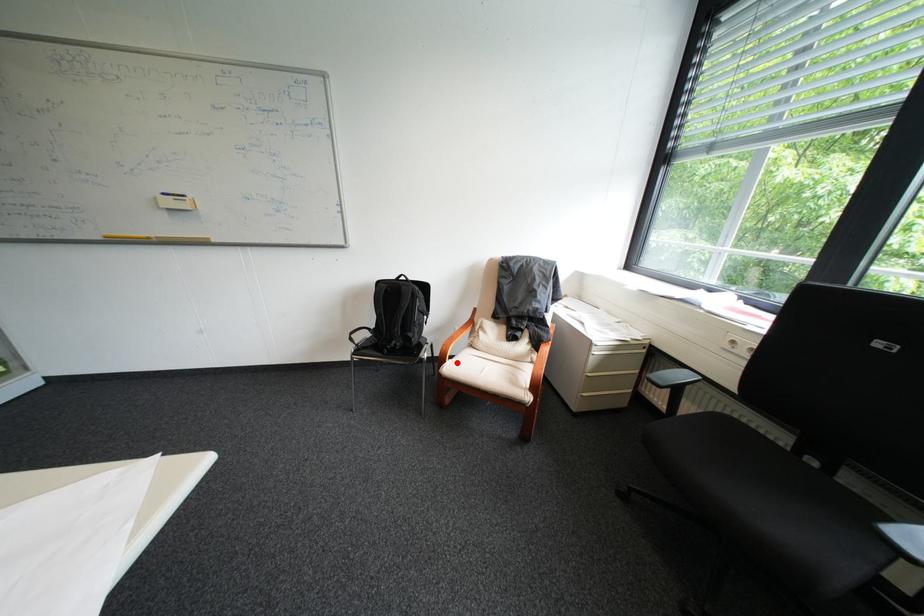
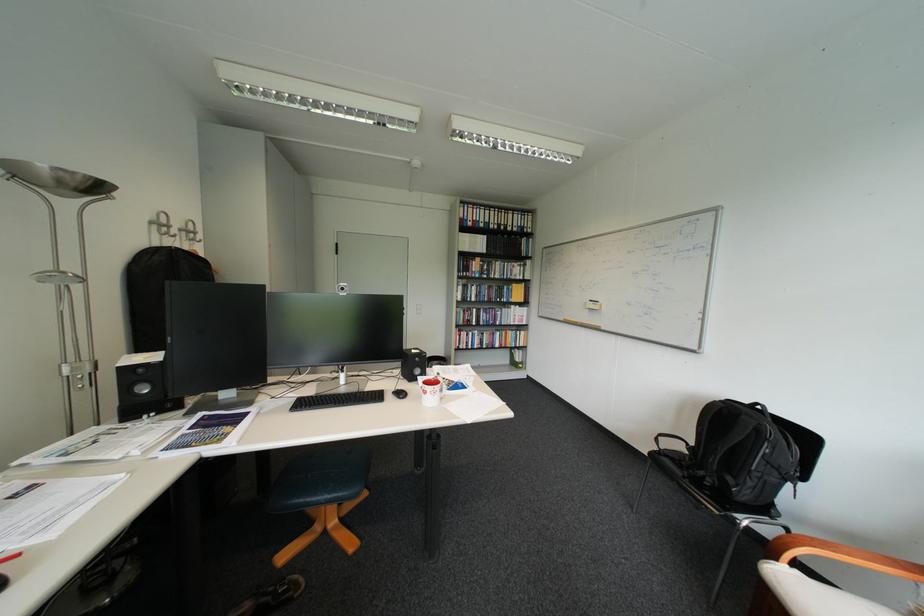
In the second image, find the point that corresponds to the highlighted location in the first image.

(788, 560)